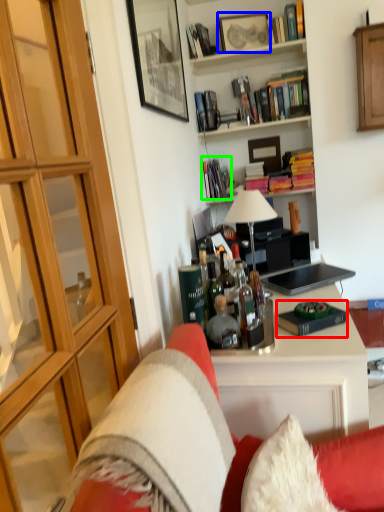
Question: Considering the real-world distances, which object is farthest from book (highlighted by a red box)? picture frame (highlighted by a blue box) or book (highlighted by a green box)?

Choices:
 (A) picture frame
 (B) book

Answer: (A)